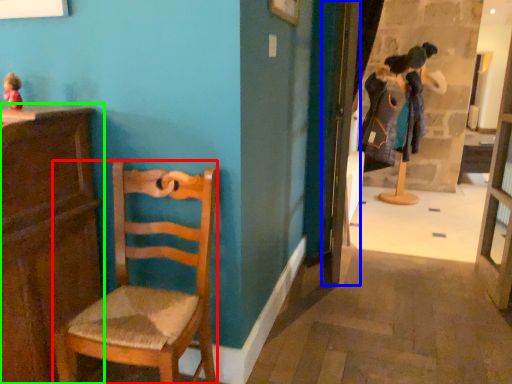
Question: Estimate the real-world distances between objects in this image. Which object is farther from chair (highlighted by a red box), door (highlighted by a blue box) or cabinetry (highlighted by a green box)?

Choices:
 (A) door
 (B) cabinetry

Answer: (A)